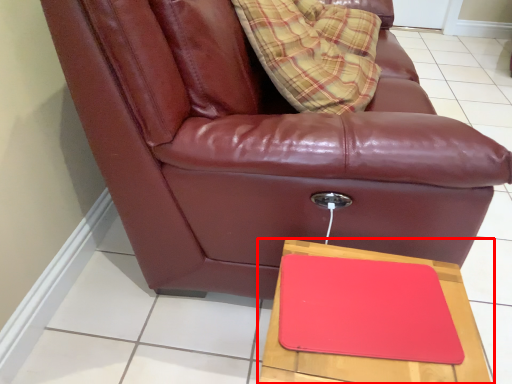
Question: Where is table (annotated by the red box) located in relation to chair in the image?

Choices:
 (A) right
 (B) left

Answer: (A)